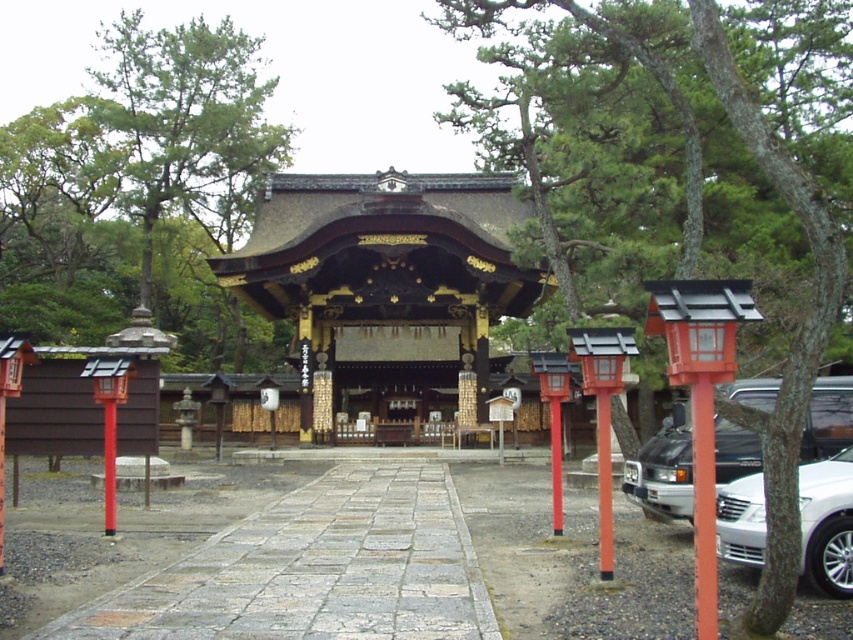
Between gold/woodenobject at center and smooth red pole at left, which one has more height?

Standing taller between the two is gold/woodenobject at center.

Does point (372, 298) come farther from viewer compared to point (105, 444)?

That is True.

Image resolution: width=853 pixels, height=640 pixels. Identify the location of gold/woodenobject at center. (386, 285).

Which is more to the right, green leafy tree at upper center or smooth red pole at left?

green leafy tree at upper center is more to the right.

Can you confirm if green leafy tree at upper center is taller than smooth red pole at left?

Indeed, green leafy tree at upper center has a greater height compared to smooth red pole at left.

The width and height of the screenshot is (853, 640). Find the location of `green leafy tree at upper center`. green leafy tree at upper center is located at coordinates (624, 52).

Does gold/woodenobject at center appear on the left side of smooth orange post at center?

Correct, you'll find gold/woodenobject at center to the left of smooth orange post at center.

Can you confirm if gold/woodenobject at center is positioned to the right of smooth orange post at center?

Incorrect, gold/woodenobject at center is not on the right side of smooth orange post at center.

Is point (454, 218) behind point (604, 419)?

Yes, it is.

Where is `gold/woodenobject at center`? The width and height of the screenshot is (853, 640). gold/woodenobject at center is located at coordinates (386, 285).